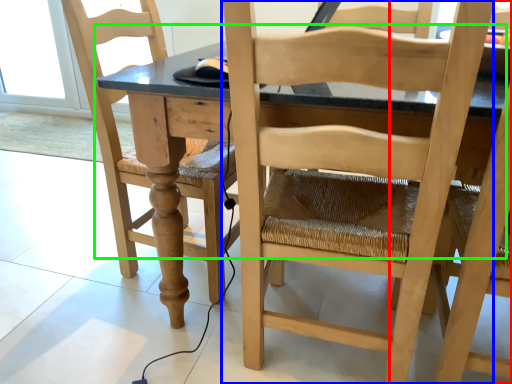
Question: Based on their relative distances, which object is nearer to chair (highlighted by a red box)? Choose from chair (highlighted by a blue box) and table (highlighted by a green box).

Choices:
 (A) chair
 (B) table

Answer: (A)